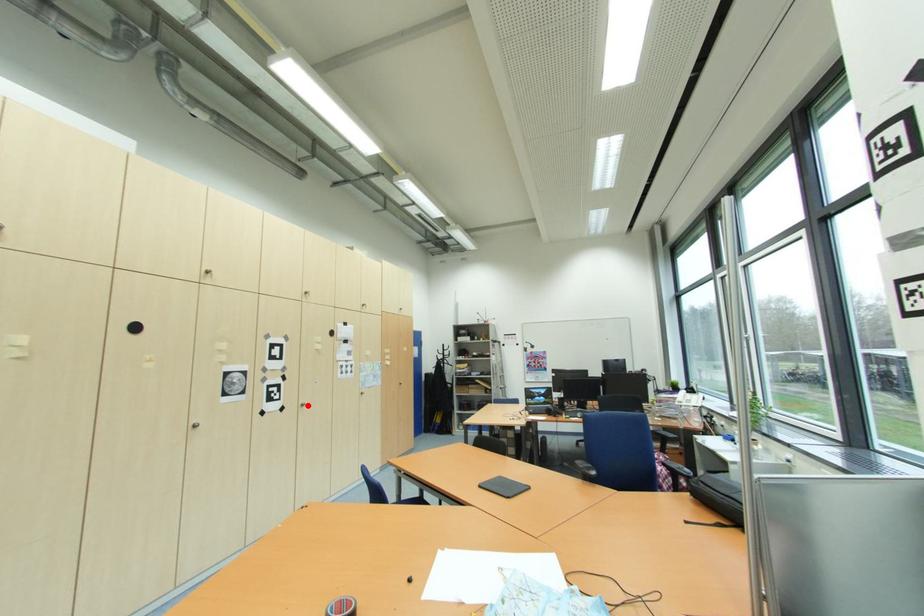
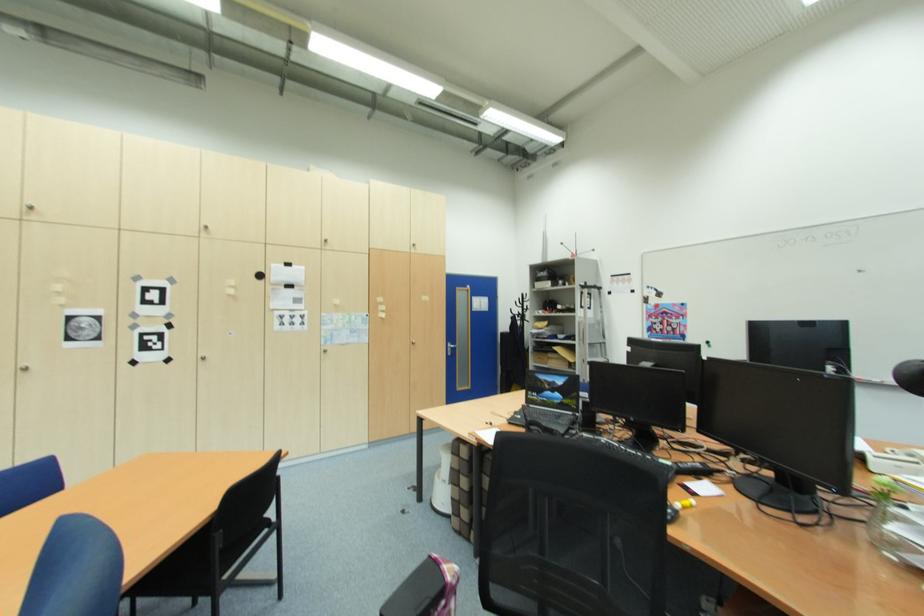
The point at the highlighted location is marked in the first image. Where is the corresponding point in the second image?

(208, 360)